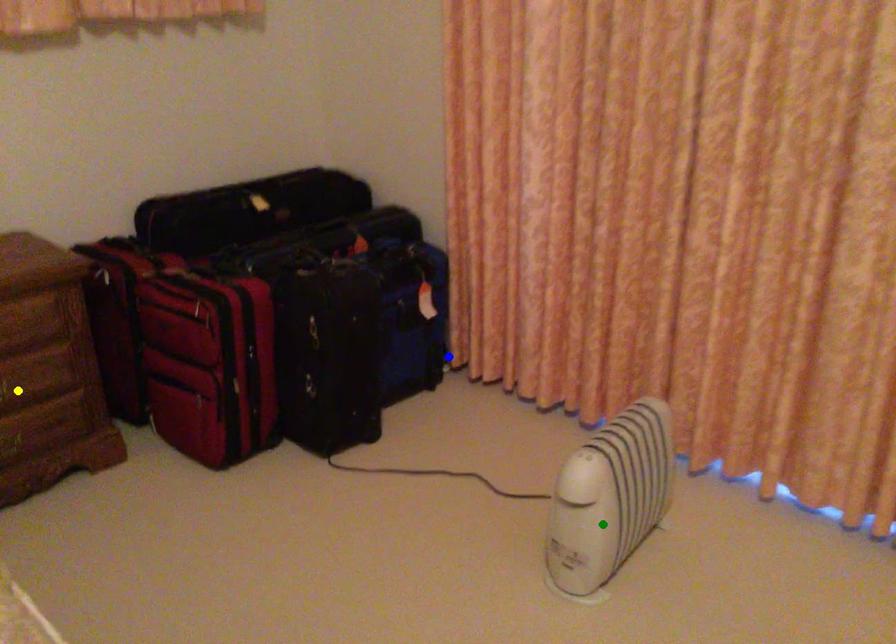
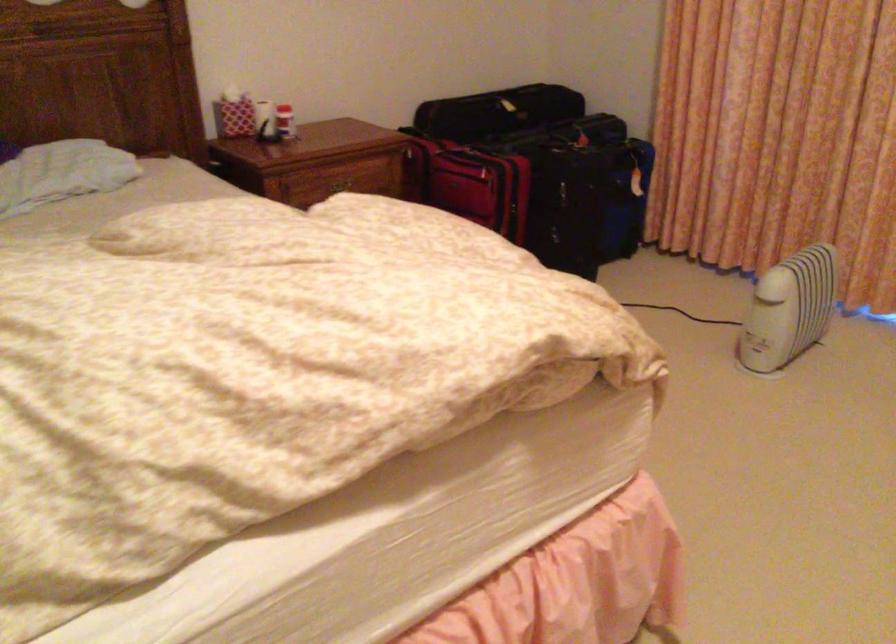
I am providing you with two images of the same scene from different viewpoints. Three points are marked in image1. Which point corresponds to a part or object that is occluded in image2?In image1, three points are marked. Which of them correspond to a part or object that is occluded in image2?Among the three points shown in image1, which one corresponds to a part or object that is no longer visible due to occlusion in image2?

yellow point cannot be seen in image2.